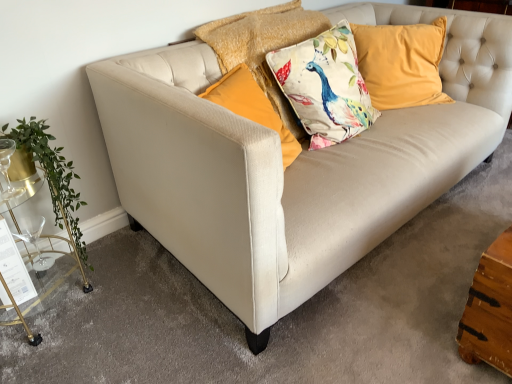
Question: Is green leafy plant at left oriented towards clear glass wine glass at lower left?

Choices:
 (A) yes
 (B) no

Answer: (B)

Question: Would you say green leafy plant at left is a long distance from clear glass wine glass at lower left?

Choices:
 (A) no
 (B) yes

Answer: (A)

Question: Are green leafy plant at left and clear glass wine glass at lower left making contact?

Choices:
 (A) yes
 (B) no

Answer: (B)

Question: Is green leafy plant at left bigger than clear glass wine glass at lower left?

Choices:
 (A) no
 (B) yes

Answer: (B)

Question: Can you confirm if green leafy plant at left is smaller than clear glass wine glass at lower left?

Choices:
 (A) no
 (B) yes

Answer: (A)

Question: In the image, is floral fabric cushion at center, acting as the 1th pillow starting from the left, positioned in front of or behind green leafy plant at left?

Choices:
 (A) behind
 (B) front

Answer: (A)

Question: Is floral fabric cushion at center, acting as the 1th pillow starting from the left, situated inside green leafy plant at left or outside?

Choices:
 (A) inside
 (B) outside

Answer: (B)

Question: Is floral fabric cushion at center, acting as the 1th pillow starting from the left, bigger or smaller than green leafy plant at left?

Choices:
 (A) small
 (B) big

Answer: (B)

Question: From the image's perspective, is floral fabric cushion at center, arranged as the second pillow when viewed from the right, located above or below green leafy plant at left?

Choices:
 (A) below
 (B) above

Answer: (B)

Question: From the image's perspective, is green leafy plant at left positioned above or below gold metallic bar cart at left?

Choices:
 (A) above
 (B) below

Answer: (A)

Question: Considering the positions of green leafy plant at left and gold metallic bar cart at left in the image, is green leafy plant at left taller or shorter than gold metallic bar cart at left?

Choices:
 (A) short
 (B) tall

Answer: (A)

Question: Considering the relative positions of green leafy plant at left and gold metallic bar cart at left in the image provided, is green leafy plant at left to the left or to the right of gold metallic bar cart at left?

Choices:
 (A) left
 (B) right

Answer: (B)

Question: Does point (91, 269) appear closer or farther from the camera than point (20, 188)?

Choices:
 (A) closer
 (B) farther

Answer: (B)

Question: Is floral fabric cushion at center, arranged as the second pillow when viewed from the right, bigger or smaller than gold metallic bar cart at left?

Choices:
 (A) small
 (B) big

Answer: (B)

Question: Choose the correct answer: Is floral fabric cushion at center, arranged as the second pillow when viewed from the right, inside gold metallic bar cart at left or outside it?

Choices:
 (A) inside
 (B) outside

Answer: (B)